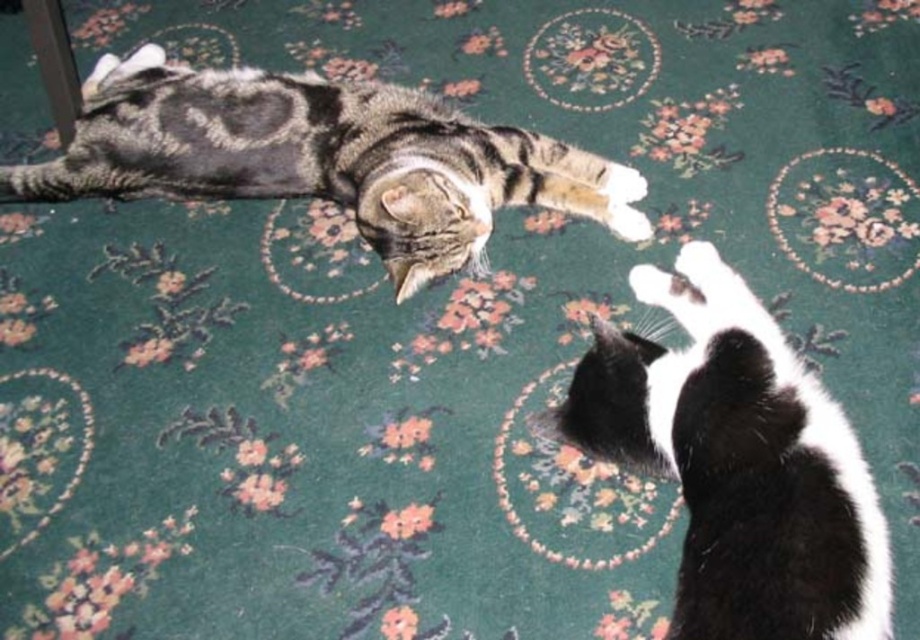
Looking at this image, is black and white fur at lower right closer to the viewer compared to tabby fur cat at upper left?

That is True.

Who is lower down, black and white fur at lower right or tabby fur cat at upper left?

black and white fur at lower right is below.

Does point (815, 625) lie behind point (445, 116)?

That is False.

This screenshot has width=920, height=640. Identify the location of black and white fur at lower right. (738, 461).